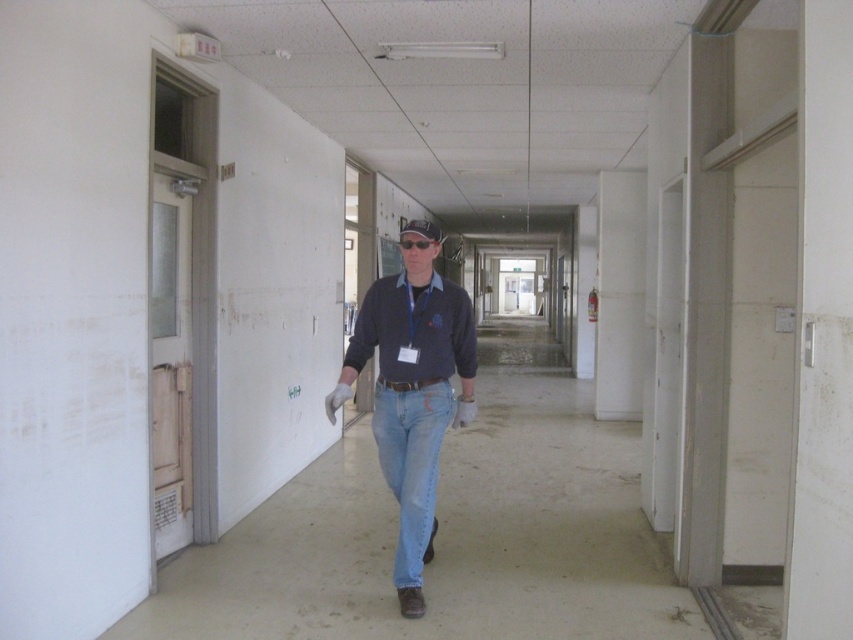
You are a security guard in the building and need to verify the clothing of the man in the image. According to the dress code policy, all employees must wear their badge visible above their clothing. Does the dark blue sweater at center and the light blue denim jeans at center comply with this policy?

The dark blue sweater at center is located above the light blue denim jeans at center, so the badge on the lanyard around his neck is visible above the clothing, complying with the dress code policy.

You are standing in the corridor and want to reach the door at the end. The dark blue sweater at center and the light blue denim jeans at center are in your path. Which part of the man should you avoid stepping on to get closer to the door?

You should avoid stepping on the light blue denim jeans at center because the dark blue sweater at center is closer to you, so the jeans are further away and less obstructive.